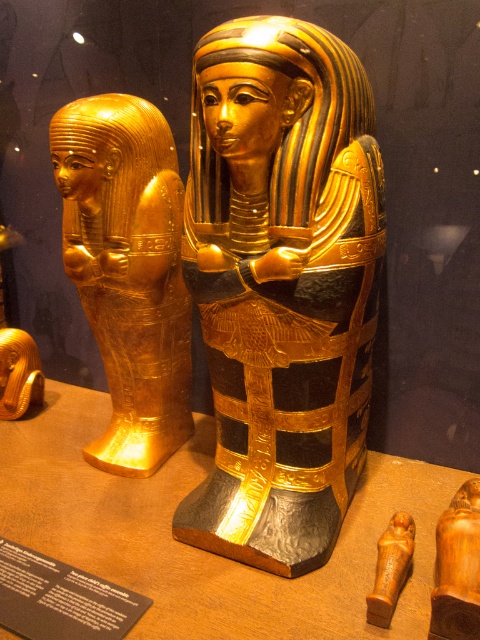
Question: Is gold/goldenmaterial/texture sarcophagus at left above wooden statue at center?

Choices:
 (A) yes
 (B) no

Answer: (A)

Question: Observing the image, what is the correct spatial positioning of gold/black textured sarcophagus at center in reference to gold/goldenmaterial/texture sarcophagus at left?

Choices:
 (A) below
 (B) above

Answer: (A)

Question: Where is metallic gold table at center located in relation to gold/goldenmaterial/texture sarcophagus at left in the image?

Choices:
 (A) left
 (B) right

Answer: (B)

Question: Which object appears farthest from the camera in this image?

Choices:
 (A) wooden statue at center
 (B) gold/goldenmaterial/texture sarcophagus at left
 (C) metallic gold table at center

Answer: (B)

Question: Among these points, which one is farthest from the camera?

Choices:
 (A) (475, 545)
 (B) (324, 344)

Answer: (B)

Question: Based on their relative distances, which object is nearer to the metallic gold table at center?

Choices:
 (A) gold/goldenmaterial/texture sarcophagus at left
 (B) gold/black textured sarcophagus at center

Answer: (B)